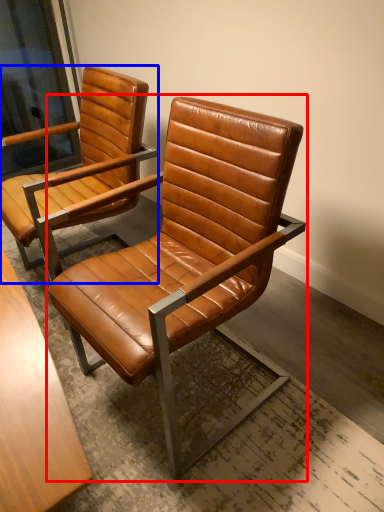
Question: Which object appears closest to the camera in this image, chair (highlighted by a red box) or chair (highlighted by a blue box)?

Choices:
 (A) chair
 (B) chair

Answer: (A)